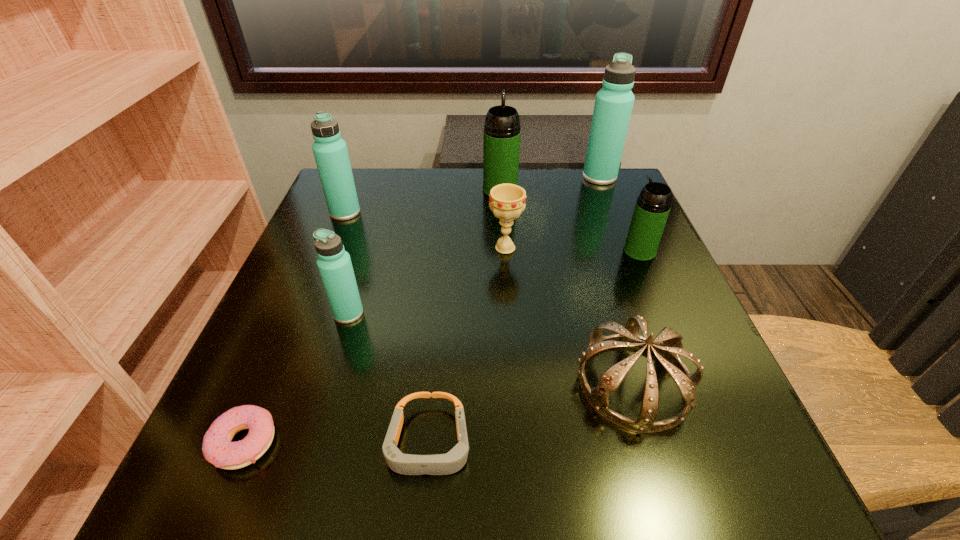
You are a GUI agent. You are given a task and a screenshot of the screen. Output one action in this format:
    pyautogui.click(x=<x>, y=<y>)
    Task: Click on the object present at the far right corner
    The image size is (960, 540).
    Given the screenshot: What is the action you would take?
    pyautogui.click(x=613, y=106)

Identify the location of vacant area at the far edge of the desktop. tap(417, 179).

Where is `vacant space at the near edge of the desktop`? This screenshot has width=960, height=540. vacant space at the near edge of the desktop is located at coordinates (373, 461).

Find the location of a particular element. This screenshot has height=540, width=960. vacant space at the left edge of the desktop is located at coordinates (315, 361).

In the image, there is a desktop. In order to click on vacant region at the far left corner in this screenshot , I will do `click(375, 219)`.

What are the coordinates of `vacant area at the near left corner of the desktop` in the screenshot? It's located at (194, 496).

At what (x,y) coordinates should I click in order to perform the action: click on vacant space at the far right corner of the desktop. Please return your answer as a coordinate pair (x, y). Looking at the image, I should click on (589, 203).

Where is `vacant space that is in between the goggles and the brown tiara`? The height and width of the screenshot is (540, 960). vacant space that is in between the goggles and the brown tiara is located at coordinates (531, 413).

The image size is (960, 540). I want to click on vacant point located between the sixth object from right to left and the tallest object, so click(515, 310).

The image size is (960, 540). I want to click on vacant point located between the leftmost aqua thermos bottle and the sixth object from right to left, so click(387, 328).